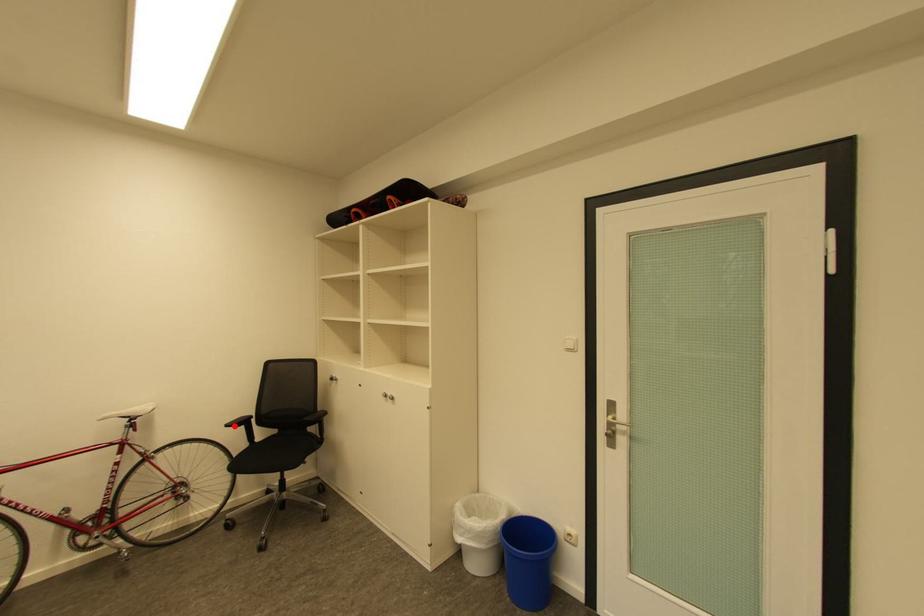
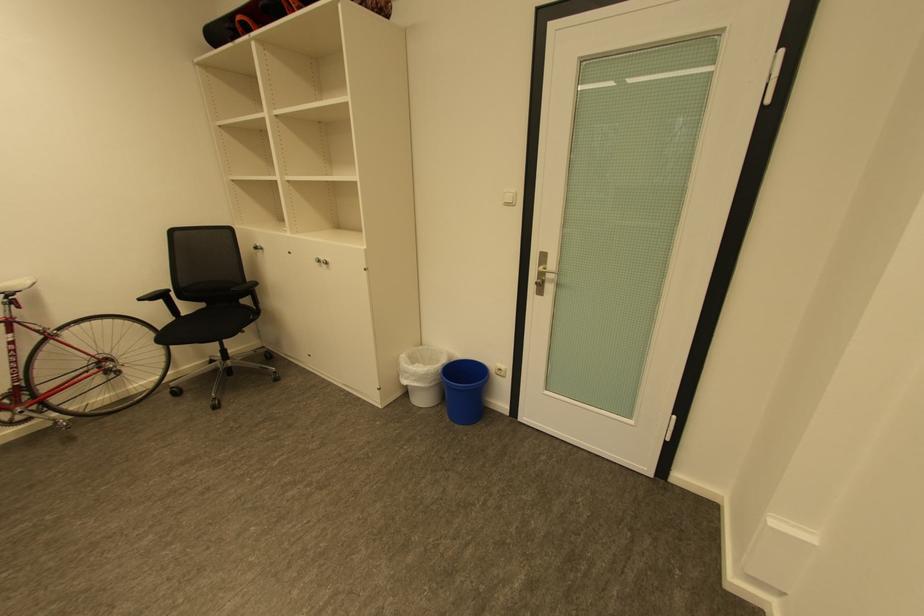
Where in the second image is the point corresponding to the highlighted location from the first image?

(148, 300)